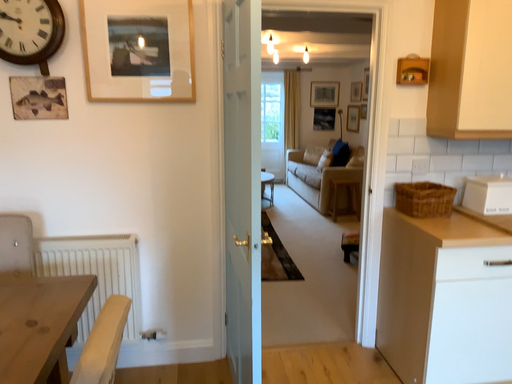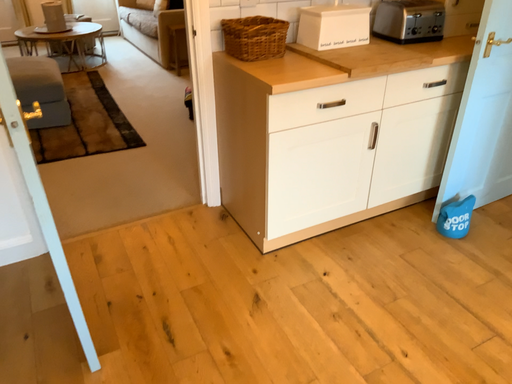
Question: Which way did the camera rotate in the video?

Choices:
 (A) rotated upward
 (B) rotated downward

Answer: (B)